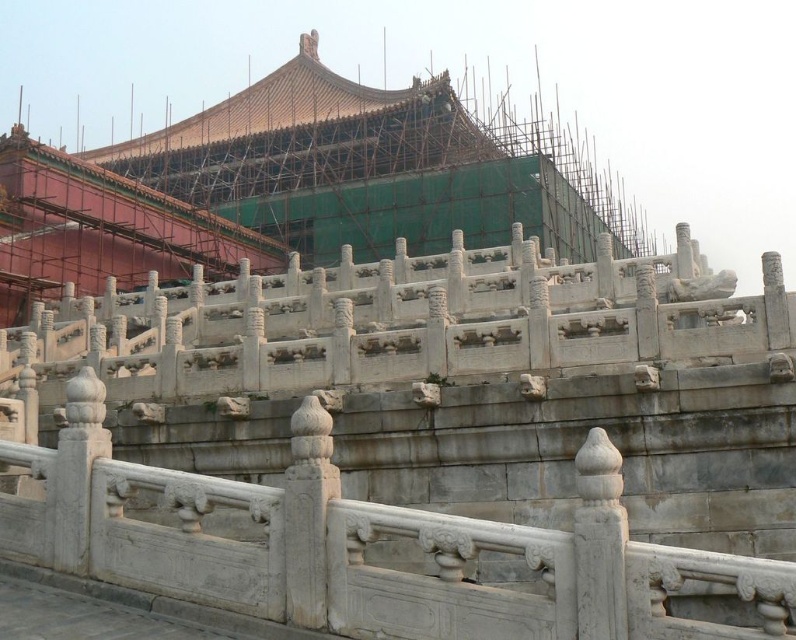
Identify the location of white stone railing at center. Image resolution: width=796 pixels, height=640 pixels. (418, 445).

Can you confirm if white stone railing at center is wider than white stone palace at center?

No, white stone railing at center is not wider than white stone palace at center.

Describe the element at coordinates (418, 445) in the screenshot. Image resolution: width=796 pixels, height=640 pixels. I see `white stone railing at center` at that location.

Find the location of a particular element. white stone railing at center is located at coordinates (418, 445).